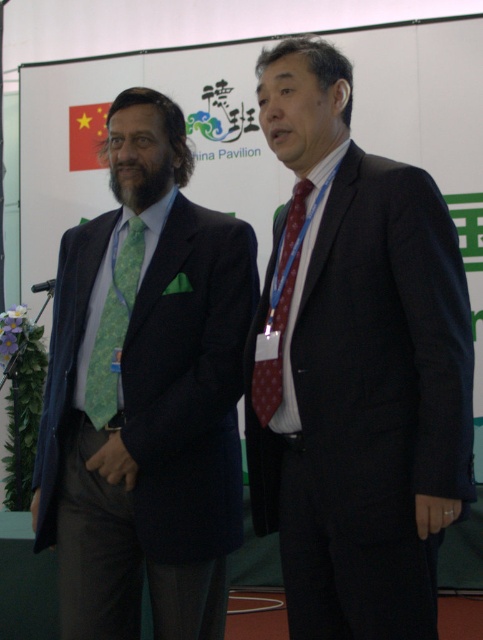
Between point (320, 497) and point (203, 442), which one is positioned in front?

Point (320, 497)

Is dark blue suit at center positioned behind green textured tie at left?

No, dark blue suit at center is in front of green textured tie at left.

Is point (257, 364) less distant than point (105, 480)?

That is True.

The width and height of the screenshot is (483, 640). What are the coordinates of `dark blue suit at center` in the screenshot? It's located at (355, 368).

Measure the distance from green patterned tie at left to maroon dotted tie at center.

green patterned tie at left and maroon dotted tie at center are 18.23 inches apart.

Identify the location of green patterned tie at left. This screenshot has width=483, height=640. (113, 326).

At what (x,y) coordinates should I click in order to perform the action: click on green patterned tie at left. Please return your answer as a coordinate pair (x, y). Looking at the image, I should click on (113, 326).

Can you confirm if dark blue suit at center is wider than green patterned tie at left?

Yes, dark blue suit at center is wider than green patterned tie at left.

Which is more to the right, dark blue suit at center or green patterned tie at left?

dark blue suit at center

The width and height of the screenshot is (483, 640). What do you see at coordinates (355, 368) in the screenshot? I see `dark blue suit at center` at bounding box center [355, 368].

Locate an element on the screen. This screenshot has width=483, height=640. dark blue suit at center is located at coordinates (355, 368).